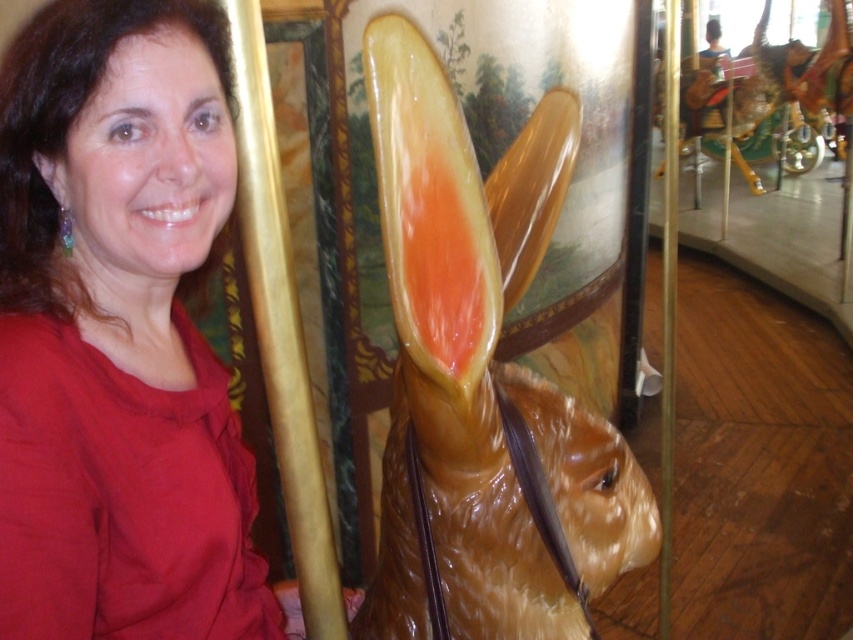
You are standing in front of the carousel and notice a specific point in the image. Can you identify what object is located at point [119,333]?

The matte red blouse at upper left is located at point [119,333].

Consider the image. You are a photographer standing in front of the carousel. You want to take a photo of the matte red blouse at upper left and the carousel horse rabbit. However, you need to ensure that the distance between them in the photo is at least 50 centimeters to frame them properly. Can you achieve this?

The matte red blouse at upper left and the carousel horse rabbit are 56.06 centimeters apart, which is more than the required 50 centimeters. Therefore, you can achieve the desired framing by capturing them at this distance.